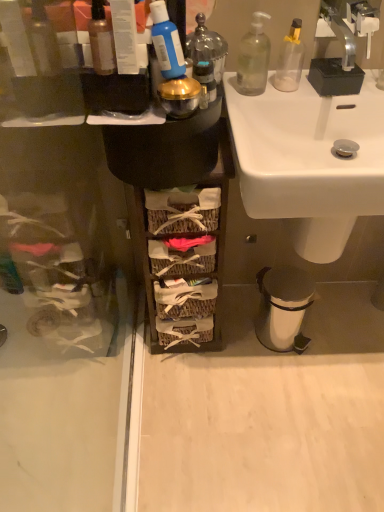
Question: Is clear glass bottle at upper right, which is the 2th bottle from front to back, not within woven wood baskets at center?

Choices:
 (A) no
 (B) yes

Answer: (B)

Question: Could you tell me if clear glass bottle at upper right, acting as the 2th bottle starting from the left, is turned towards woven wood baskets at center?

Choices:
 (A) no
 (B) yes

Answer: (A)

Question: Are clear glass bottle at upper right, placed as the second bottle when sorted from right to left, and woven wood baskets at center beside each other?

Choices:
 (A) no
 (B) yes

Answer: (A)

Question: Does clear glass bottle at upper right, acting as the 2th bottle starting from the left, have a smaller size compared to woven wood baskets at center?

Choices:
 (A) yes
 (B) no

Answer: (A)

Question: Considering the relative positions of clear glass bottle at upper right, acting as the 2th bottle starting from the left, and woven wood baskets at center in the image provided, is clear glass bottle at upper right, acting as the 2th bottle starting from the left, to the right of woven wood baskets at center from the viewer's perspective?

Choices:
 (A) yes
 (B) no

Answer: (A)

Question: Considering the positions of point (311, 287) and point (94, 59), is point (311, 287) closer or farther from the camera than point (94, 59)?

Choices:
 (A) farther
 (B) closer

Answer: (A)

Question: In the image, is silver metallic trash can at lower right on the left side or the right side of translucent glass bottle at upper left, placed as the first bottle when sorted from left to right?

Choices:
 (A) right
 (B) left

Answer: (A)

Question: From a real-world perspective, is silver metallic trash can at lower right above or below translucent glass bottle at upper left, which ranks as the first bottle in front-to-back order?

Choices:
 (A) above
 (B) below

Answer: (B)

Question: In terms of height, does silver metallic trash can at lower right look taller or shorter compared to translucent glass bottle at upper left, marked as the third bottle in a right-to-left arrangement?

Choices:
 (A) short
 (B) tall

Answer: (B)

Question: Looking at their shapes, would you say blue matte toothpaste tube at upper center, the 2th toiletry from the back, is wider or thinner than transparent plastic screen door at left?

Choices:
 (A) thin
 (B) wide

Answer: (A)

Question: From a real-world perspective, relative to transparent plastic screen door at left, is blue matte toothpaste tube at upper center, acting as the first toiletry starting from the front, vertically above or below?

Choices:
 (A) below
 (B) above

Answer: (B)

Question: Is blue matte toothpaste tube at upper center, the 2th toiletry from the back, bigger or smaller than transparent plastic screen door at left?

Choices:
 (A) small
 (B) big

Answer: (A)

Question: From the image's perspective, is blue matte toothpaste tube at upper center, acting as the first toiletry starting from the front, located above or below transparent plastic screen door at left?

Choices:
 (A) above
 (B) below

Answer: (A)

Question: Considering the positions of point (248, 68) and point (279, 47), is point (248, 68) closer or farther from the camera than point (279, 47)?

Choices:
 (A) farther
 (B) closer

Answer: (A)

Question: Is clear glass bottle at upper right, placed as the second bottle when sorted from right to left, wider or thinner than transparent plastic bottle at upper right, the 3th bottle positioned from the left?

Choices:
 (A) wide
 (B) thin

Answer: (A)